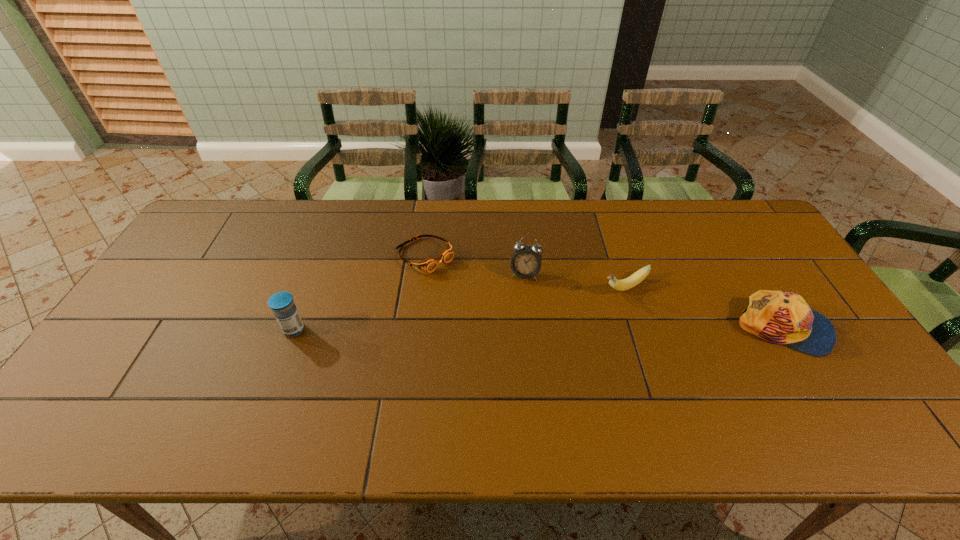
The height and width of the screenshot is (540, 960). I want to click on vacant space on the desktop that is between the medicine and the cap and is positioned at the stem of the fourth object from left to right, so click(544, 329).

Find the location of a particular element. vacant spot on the desktop that is between the medicine and the cap and is positioned on the face of the alarm clock is located at coordinates (515, 329).

The height and width of the screenshot is (540, 960). Identify the location of vacant spot on the desktop that is between the medicine and the rightmost object and is positioned with the lenses facing forward on the goggles. click(511, 329).